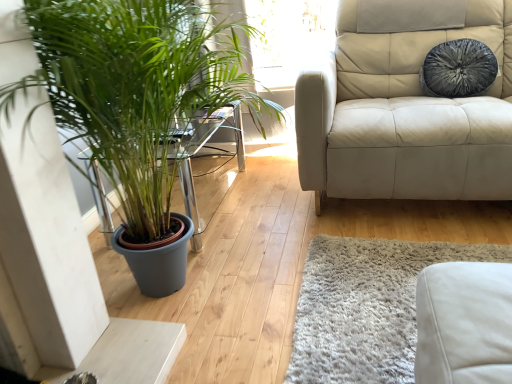
Question: From a real-world perspective, is green matte plant at left positioned over velvety gray pillow at upper right based on gravity?

Choices:
 (A) yes
 (B) no

Answer: (B)

Question: Is green matte plant at left further to camera compared to velvety gray pillow at upper right?

Choices:
 (A) no
 (B) yes

Answer: (A)

Question: Are green matte plant at left and velvety gray pillow at upper right located far from each other?

Choices:
 (A) no
 (B) yes

Answer: (B)

Question: Can you see green matte plant at left touching velvety gray pillow at upper right?

Choices:
 (A) no
 (B) yes

Answer: (A)

Question: Does green matte plant at left have a lesser width compared to velvety gray pillow at upper right?

Choices:
 (A) no
 (B) yes

Answer: (A)

Question: From the image's perspective, is green matte plant at left on top of velvety gray pillow at upper right?

Choices:
 (A) no
 (B) yes

Answer: (A)

Question: Can you confirm if velvety gray pillow at upper right is shorter than green matte plant at left?

Choices:
 (A) yes
 (B) no

Answer: (A)

Question: From a real-world perspective, does velvety gray pillow at upper right stand above green matte plant at left?

Choices:
 (A) yes
 (B) no

Answer: (A)

Question: Considering the relative positions of velvety gray pillow at upper right and green matte plant at left in the image provided, is velvety gray pillow at upper right in front of green matte plant at left?

Choices:
 (A) yes
 (B) no

Answer: (B)

Question: Is velvety gray pillow at upper right positioned beyond the bounds of green matte plant at left?

Choices:
 (A) yes
 (B) no

Answer: (A)

Question: Is green matte plant at left located within velvety gray pillow at upper right?

Choices:
 (A) no
 (B) yes

Answer: (A)

Question: Does velvety gray pillow at upper right appear on the left side of green matte plant at left?

Choices:
 (A) yes
 (B) no

Answer: (B)

Question: In terms of height, does green matte plant at left look taller or shorter compared to velvety gray pillow at upper right?

Choices:
 (A) short
 (B) tall

Answer: (B)